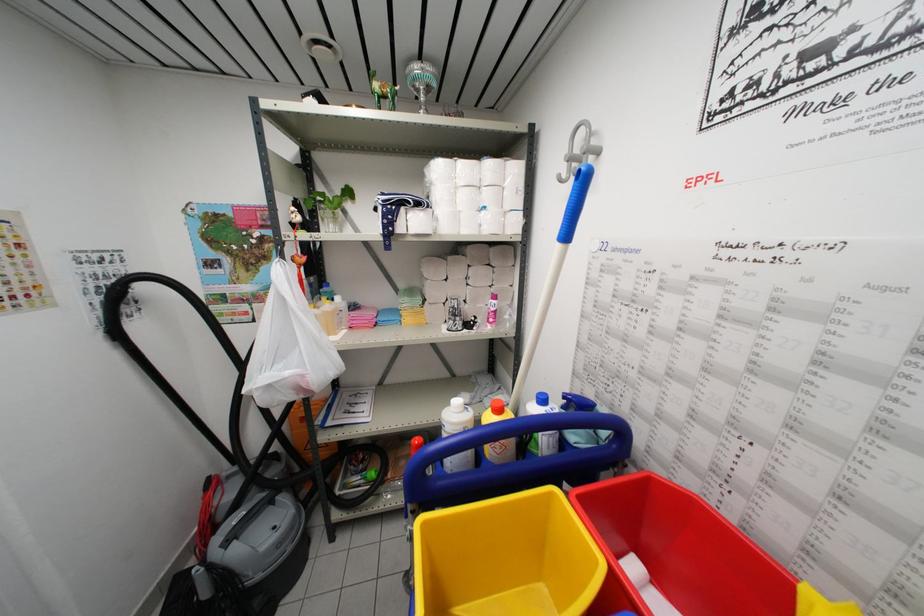
Find the location of a particular element. This screenshot has height=616, width=924. small glass cup is located at coordinates (454, 314).